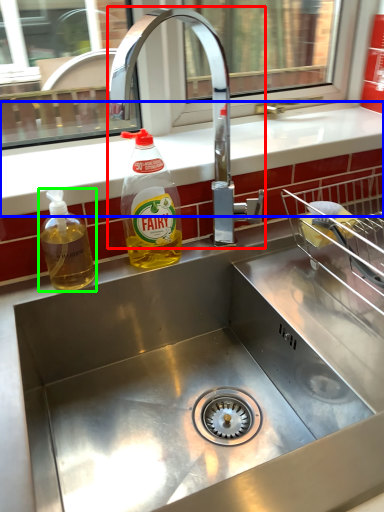
Question: Which object is positioned farthest from tap (highlighted by a red box)? Select from counter top (highlighted by a blue box) and bottle (highlighted by a green box).

Choices:
 (A) counter top
 (B) bottle

Answer: (B)